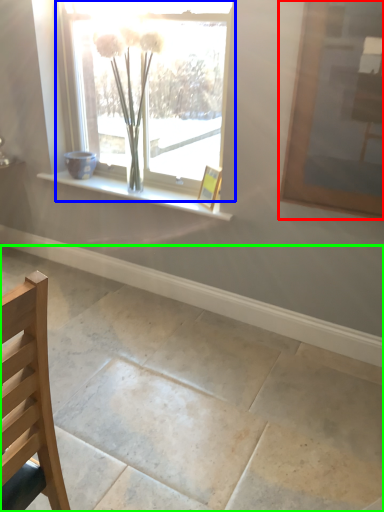
Question: Which object is the farthest from picture frame (highlighted by a red box)? Choose among these: window (highlighted by a blue box) or concrete (highlighted by a green box).

Choices:
 (A) window
 (B) concrete

Answer: (B)